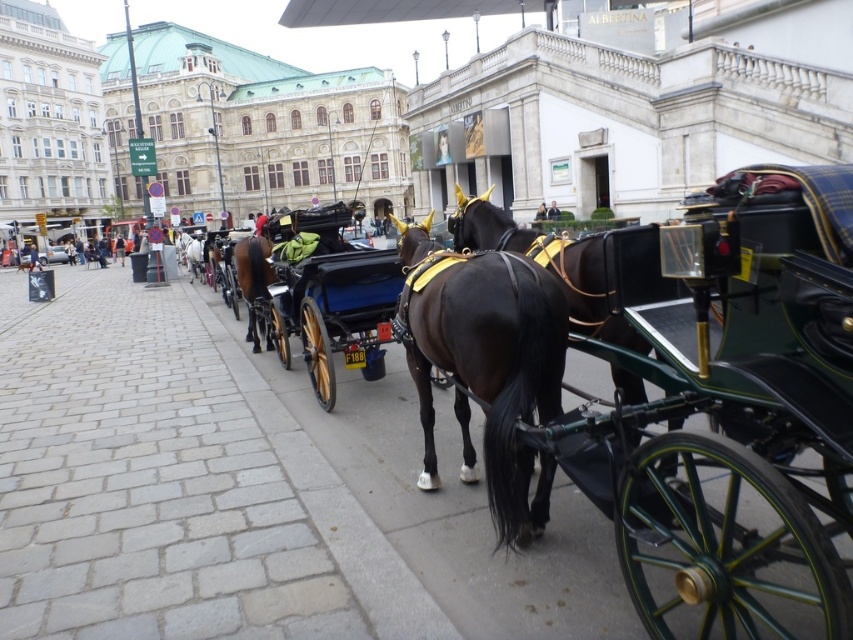
In the scene shown: You are a tourist standing at the edge of the cobblestone street. You see the gray cobblestone pavement at lower left and the shiny brown horse at center. Which object is closer to you?

The gray cobblestone pavement at lower left is closer to you because it is in front of the shiny brown horse at center.

You are standing at the entrance of the cobblestone street and want to walk to the dark brown horse harnessed to a carriage. Which direction should you head relative to the gray cobblestone pavement at lower left?

The gray cobblestone pavement at lower left is located at point (171, 484), so you should head towards the upper right direction from the gray cobblestone pavement at lower left to reach the dark brown horse harnessed to a carriage.

You are standing at the origin point in the image. The shiny black horse at center is located at coordinates. Which direction should you move to reach it?

The shiny black horse at center is located at coordinates point (550,264). Since the origin is at the bottom left corner of the image, you should move towards the upper right direction to reach it.